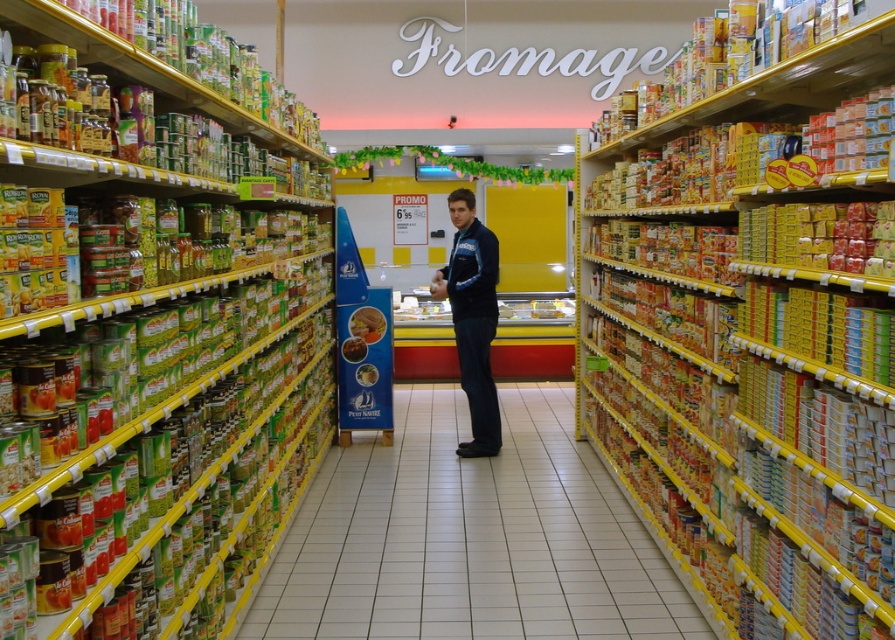
You are a customer in the grocery store and want to compare the sizes of the items at the center of the aisle. Which one is bigger between the smooth plastic butter at center and the green matte jar at center?

The smooth plastic butter at center is larger in size compared to the green matte jar at center.